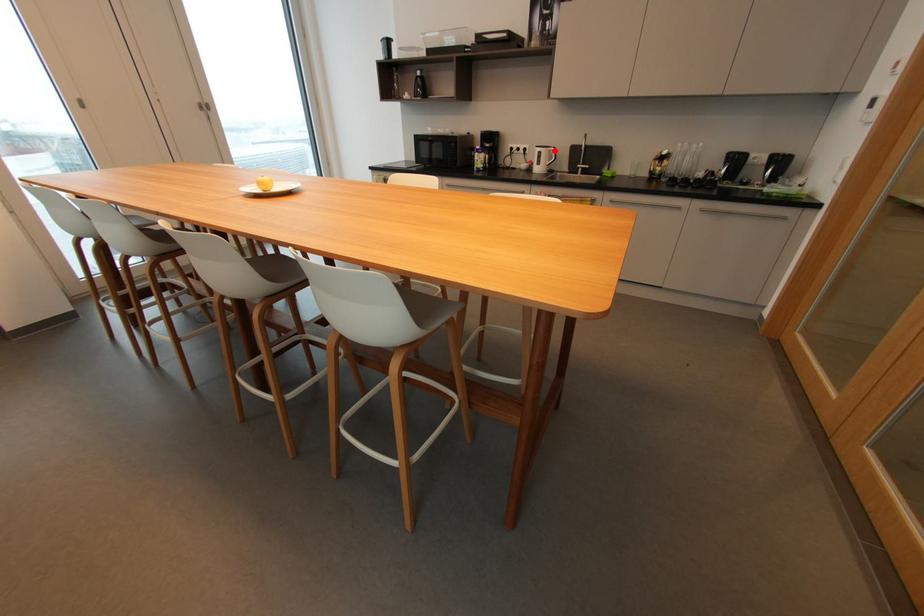
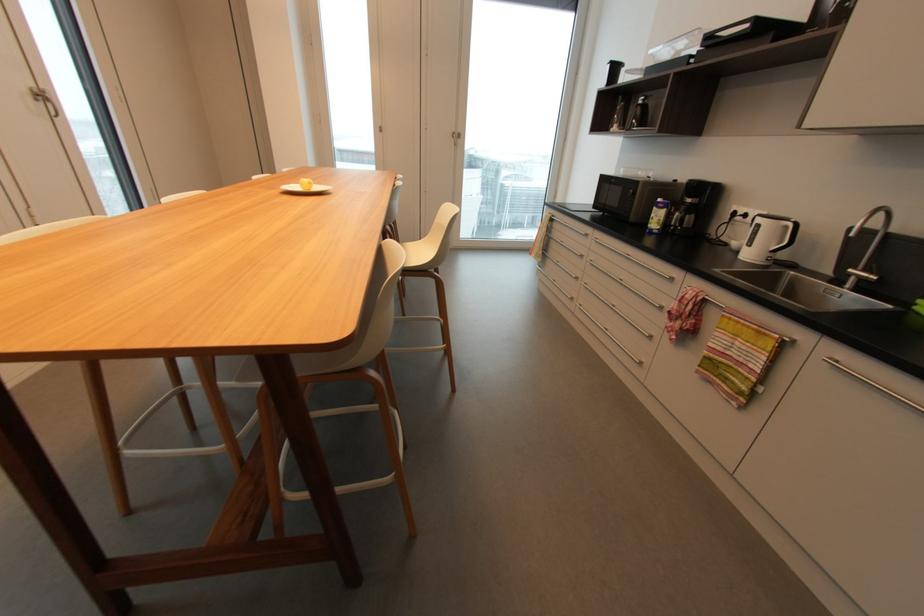
Find the pixel in the second image that matches the highlighted location in the first image.

(789, 227)